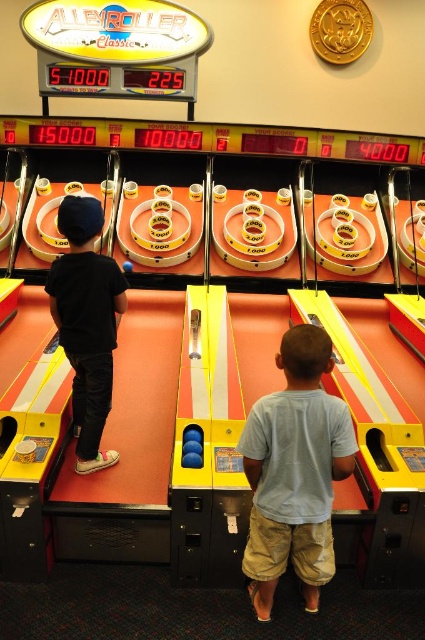
Is point (334, 420) positioned before point (99, 432)?

Yes.

Can you confirm if light blue cotton shirt at center is positioned to the right of black matte shirt at left?

Yes, light blue cotton shirt at center is to the right of black matte shirt at left.

You are a GUI agent. You are given a task and a screenshot of the screen. Output one action in this format:
    pyautogui.click(x=<x>, y=<y>)
    Task: Click on the light blue cotton shirt at center
    
    Given the screenshot: What is the action you would take?
    pyautogui.click(x=294, y=472)